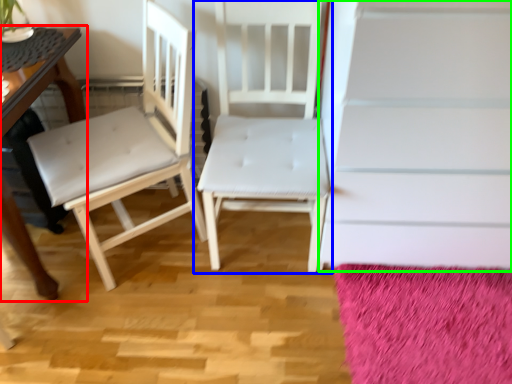
Question: Which is farther away from table (highlighted by a red box)? chair (highlighted by a blue box) or stairwell (highlighted by a green box)?

Choices:
 (A) chair
 (B) stairwell

Answer: (B)